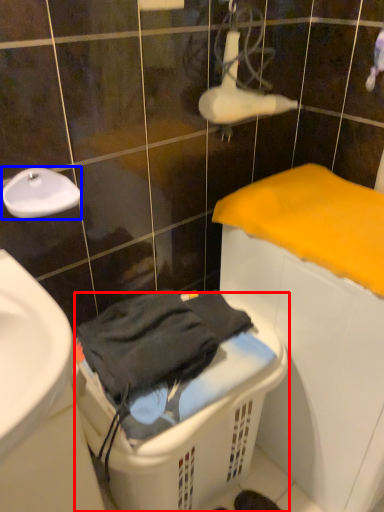
Question: Which of the following is the closest to the observer, laundry basket (highlighted by a red box) or faucet (highlighted by a blue box)?

Choices:
 (A) laundry basket
 (B) faucet

Answer: (A)